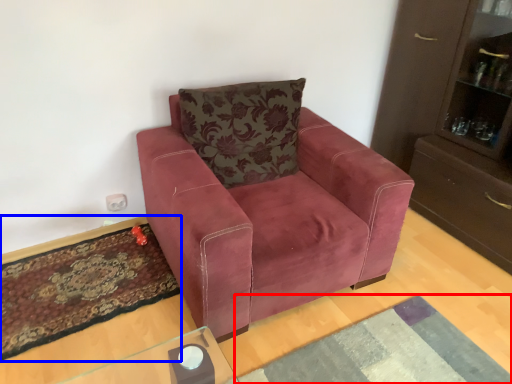
Question: Which point is further to the camera, mat (highlighted by a red box) or mat (highlighted by a blue box)?

Choices:
 (A) mat
 (B) mat

Answer: (B)